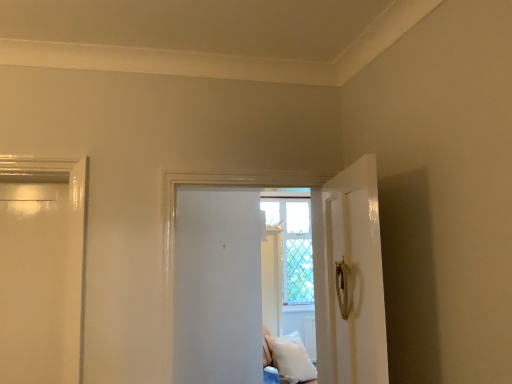
Describe the element at coordinates (291, 357) in the screenshot. I see `white soft pillow at lower center` at that location.

What is the approximate width of white matte door at center?

13.08 inches.

The width and height of the screenshot is (512, 384). Identify the location of white soft pillow at lower center. (291, 357).

How distant is clear glass window at center from white soft pillow at lower center?

They are 27.19 inches apart.

Is clear glass window at center closer to the viewer compared to white soft pillow at lower center?

No, the depth of clear glass window at center is greater than that of white soft pillow at lower center.

Does clear glass window at center have a larger size compared to white soft pillow at lower center?

Actually, clear glass window at center might be smaller than white soft pillow at lower center.

Based on the photo, who is shorter, clear glass window at center or white soft pillow at lower center?

white soft pillow at lower center is shorter.

Which object is positioned more to the left, white matte door at center or clear glass window at center?

From the viewer's perspective, white matte door at center appears more on the left side.

Is point (351, 341) in front of point (291, 288)?

Yes, it is.

Can you confirm if white matte door at center is wider than clear glass window at center?

Yes.

Relative to white matte door at center, is white soft pillow at lower center in front or behind?

Clearly, white soft pillow at lower center is behind white matte door at center.

Based on the photo, in the image, is white soft pillow at lower center on the left side or the right side of white matte door at center?

white soft pillow at lower center is to the right of white matte door at center.

Locate an element on the screen. The image size is (512, 384). door above the white soft pillow at lower center (from the image's perspective) is located at coordinates (317, 266).

Is clear glass window at center wider or thinner than white matte door at center?

Clearly, clear glass window at center has less width compared to white matte door at center.

From the picture: Relative to white matte door at center, is clear glass window at center in front or behind?

clear glass window at center is positioned farther from the viewer than white matte door at center.

From a real-world perspective, is clear glass window at center over white matte door at center?

Correct, in the physical world, clear glass window at center is higher than white matte door at center.

Which is behind, point (201, 181) or point (290, 350)?

Point (290, 350)

Considering the sizes of white matte door at center and white soft pillow at lower center in the image, is white matte door at center taller or shorter than white soft pillow at lower center?

Considering their sizes, white matte door at center has more height than white soft pillow at lower center.

Who is smaller, white matte door at center or white soft pillow at lower center?

With smaller size is white soft pillow at lower center.

Is white soft pillow at lower center positioned with its back to clear glass window at center?

No, white soft pillow at lower center is not facing away from clear glass window at center.

Is white soft pillow at lower center with clear glass window at center?

No, white soft pillow at lower center is not touching clear glass window at center.

From the image's perspective, which one is positioned higher, white soft pillow at lower center or clear glass window at center?

From the image's view, clear glass window at center is above.

Does point (283, 356) appear closer or farther from the camera than point (268, 217)?

Point (283, 356) is positioned closer to the camera compared to point (268, 217).

The image size is (512, 384). I want to click on window located above the white soft pillow at lower center (from a real-world perspective), so click(293, 246).

Find the location of a particular element. The width and height of the screenshot is (512, 384). window lying behind the white matte door at center is located at coordinates (293, 246).

Looking at the image, which one is located closer to white matte door at center, clear glass window at center or white soft pillow at lower center?

Among the two, white soft pillow at lower center is located nearer to white matte door at center.

Which object lies further to the anchor point white soft pillow at lower center, clear glass window at center or white matte door at center?

white matte door at center lies further to white soft pillow at lower center than the other object.

Based on their spatial positions, is white soft pillow at lower center or clear glass window at center further from white matte door at center?

clear glass window at center is further to white matte door at center.

Which object lies further to the anchor point clear glass window at center, white matte door at center or white soft pillow at lower center?

Among the two, white matte door at center is located further to clear glass window at center.

Consider the image. When comparing their distances from clear glass window at center, does white soft pillow at lower center or white matte door at center seem further?

The object further to clear glass window at center is white matte door at center.

From the image, which object appears to be farther from white soft pillow at lower center, white matte door at center or clear glass window at center?

white matte door at center is positioned further to the anchor white soft pillow at lower center.

Identify the location of pillow between white matte door at center and clear glass window at center along the z-axis. This screenshot has height=384, width=512. (291, 357).